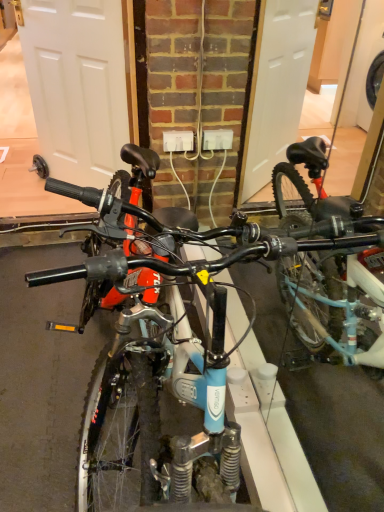
Question: Can you confirm if white matte door at left is positioned to the right of white plastic power outlet at center?

Choices:
 (A) no
 (B) yes

Answer: (A)

Question: From a real-world perspective, is white matte door at left on white plastic power outlet at center?

Choices:
 (A) no
 (B) yes

Answer: (B)

Question: From the image's perspective, does white matte door at left appear lower than white plastic power outlet at center?

Choices:
 (A) no
 (B) yes

Answer: (A)

Question: Does white matte door at left appear on the left side of white plastic power outlet at center?

Choices:
 (A) no
 (B) yes

Answer: (B)

Question: Can you confirm if white matte door at left is thinner than white plastic power outlet at center?

Choices:
 (A) yes
 (B) no

Answer: (B)

Question: Is white matte door at left placed right next to white plastic power outlet at center?

Choices:
 (A) yes
 (B) no

Answer: (B)

Question: Is white plastic power outlet at center not near blue matte bicycle at center?

Choices:
 (A) yes
 (B) no

Answer: (A)

Question: From the image's perspective, is white plastic power outlet at center beneath blue matte bicycle at center?

Choices:
 (A) no
 (B) yes

Answer: (A)

Question: Considering the relative sizes of white plastic power outlet at center and blue matte bicycle at center in the image provided, is white plastic power outlet at center bigger than blue matte bicycle at center?

Choices:
 (A) yes
 (B) no

Answer: (B)

Question: From a real-world perspective, is white plastic power outlet at center located higher than blue matte bicycle at center?

Choices:
 (A) no
 (B) yes

Answer: (B)

Question: Does white plastic power outlet at center turn towards blue matte bicycle at center?

Choices:
 (A) no
 (B) yes

Answer: (B)

Question: Is white plastic power outlet at center outside of blue matte bicycle at center?

Choices:
 (A) no
 (B) yes

Answer: (B)

Question: Is blue matte bicycle at center closer to camera compared to white plastic power outlet at center?

Choices:
 (A) no
 (B) yes

Answer: (B)